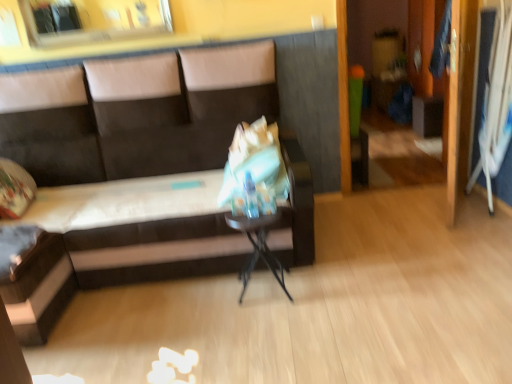
At what (x,y) coordinates should I click in order to perform the action: click on spots to the right of metallic silver table at center. Please return your answer as a coordinate pair (x, y). The width and height of the screenshot is (512, 384). Looking at the image, I should click on (317, 288).